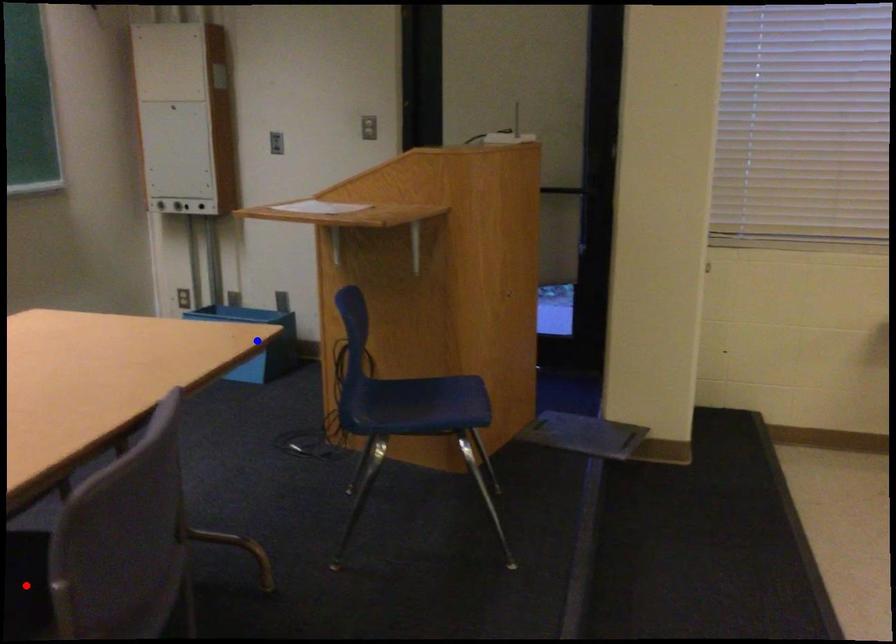
Question: Two points are marked on the image. Which point is closer to the camera?

Choices:
 (A) Blue point is closer.
 (B) Red point is closer.

Answer: (B)